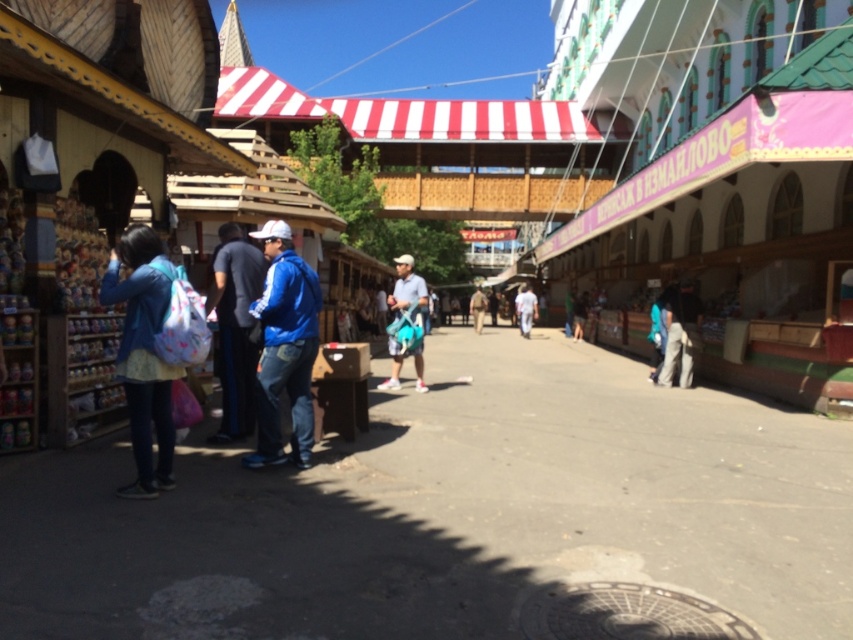
Between white fabric shirt at center and blue denim jacket at center, which one appears on the right side from the viewer's perspective?

Positioned to the right is blue denim jacket at center.

Measure the distance between white fabric shirt at center and blue denim jacket at center.

white fabric shirt at center is 5.53 meters away from blue denim jacket at center.

The height and width of the screenshot is (640, 853). What do you see at coordinates (525, 308) in the screenshot?
I see `white fabric shirt at center` at bounding box center [525, 308].

This screenshot has height=640, width=853. Find the location of `white fabric shirt at center`. white fabric shirt at center is located at coordinates (525, 308).

Can you confirm if matte blue shorts at center is positioned to the left of white fabric shirt at center?

Indeed, matte blue shorts at center is positioned on the left side of white fabric shirt at center.

The image size is (853, 640). Find the location of `matte blue shorts at center`. matte blue shorts at center is located at coordinates (407, 291).

The width and height of the screenshot is (853, 640). Identify the location of matte blue shorts at center. (407, 291).

Who is positioned more to the right, blue matte jacket at center or white fabric shirt at center?

Positioned to the right is white fabric shirt at center.

Is blue matte jacket at center positioned in front of white fabric shirt at center?

Yes.

Locate an element on the screen. Image resolution: width=853 pixels, height=640 pixels. blue matte jacket at center is located at coordinates (283, 348).